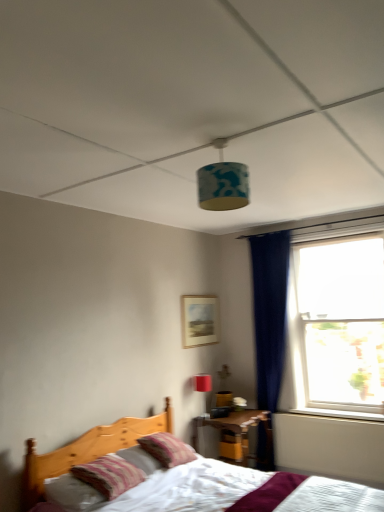
Question: Would you say striped fabric pillow at center, arranged as the 1th pillow when viewed from the back, is part of matte wooden picture frame at center's contents?

Choices:
 (A) no
 (B) yes

Answer: (A)

Question: From a real-world perspective, is matte wooden picture frame at center physically above striped fabric pillow at center, placed as the second pillow when sorted from front to back?

Choices:
 (A) no
 (B) yes

Answer: (B)

Question: Does matte wooden picture frame at center have a greater width compared to striped fabric pillow at center, arranged as the 1th pillow when viewed from the back?

Choices:
 (A) no
 (B) yes

Answer: (A)

Question: Does matte wooden picture frame at center have a smaller size compared to striped fabric pillow at center, placed as the second pillow when sorted from front to back?

Choices:
 (A) yes
 (B) no

Answer: (A)

Question: Does matte wooden picture frame at center appear on the right side of striped fabric pillow at center, placed as the second pillow when sorted from front to back?

Choices:
 (A) no
 (B) yes

Answer: (B)

Question: In the image, is matte wooden picture frame at center positioned in front of or behind white plastic window sill at lower right?

Choices:
 (A) front
 (B) behind

Answer: (B)

Question: In terms of width, does matte wooden picture frame at center look wider or thinner when compared to white plastic window sill at lower right?

Choices:
 (A) wide
 (B) thin

Answer: (B)

Question: From the image's perspective, relative to white plastic window sill at lower right, is matte wooden picture frame at center above or below?

Choices:
 (A) above
 (B) below

Answer: (A)

Question: From a real-world perspective, is matte wooden picture frame at center positioned above or below white plastic window sill at lower right?

Choices:
 (A) above
 (B) below

Answer: (A)

Question: Relative to wooden nightstand at lower center, is transparent glass window at right in front or behind?

Choices:
 (A) front
 (B) behind

Answer: (A)

Question: From the image's perspective, is transparent glass window at right located above or below wooden nightstand at lower center?

Choices:
 (A) below
 (B) above

Answer: (B)

Question: Would you say transparent glass window at right is to the left or to the right of wooden nightstand at lower center in the picture?

Choices:
 (A) left
 (B) right

Answer: (B)

Question: Based on their sizes in the image, would you say transparent glass window at right is bigger or smaller than wooden nightstand at lower center?

Choices:
 (A) big
 (B) small

Answer: (A)

Question: Is point (319, 240) closer or farther from the camera than point (203, 380)?

Choices:
 (A) closer
 (B) farther

Answer: (B)

Question: From a real-world perspective, is transparent glass window at right positioned above or below matte red table lamp at upper center?

Choices:
 (A) below
 (B) above

Answer: (B)